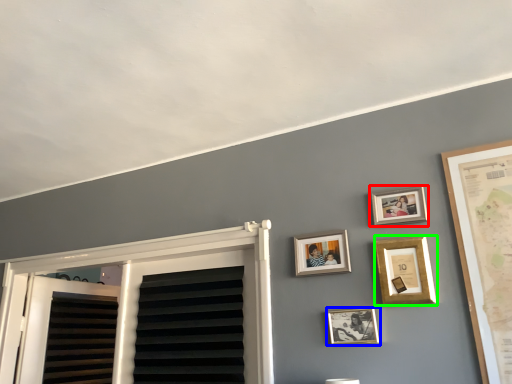
Question: Estimate the real-world distances between objects in this image. Which object is closer to picture frame (highlighted by a red box), picture frame (highlighted by a blue box) or picture frame (highlighted by a green box)?

Choices:
 (A) picture frame
 (B) picture frame

Answer: (B)